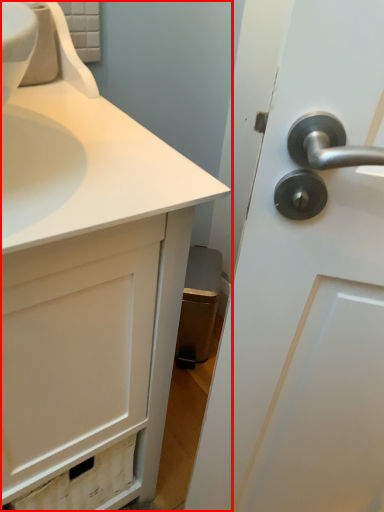
Question: In this image, where is bathroom cabinet (annotated by the red box) located relative to faucet?

Choices:
 (A) left
 (B) right

Answer: (B)